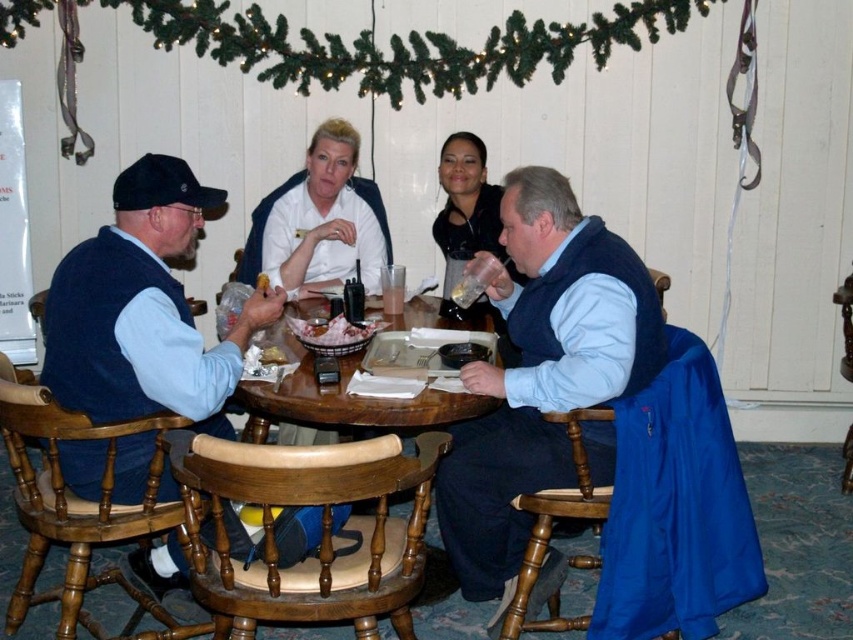
Question: Which of the following is the closest to the observer?

Choices:
 (A) matte brown basket at center
 (B) blue fleece vest at center

Answer: (B)

Question: Does blue denim vest at left appear under white smooth shirt at center?

Choices:
 (A) yes
 (B) no

Answer: (A)

Question: Does blue fleece vest at center have a larger size compared to translucent plastic cup at center?

Choices:
 (A) yes
 (B) no

Answer: (A)

Question: Which object is farther from the camera taking this photo?

Choices:
 (A) blue fleece vest at center
 (B) wooden table at center
 (C) matte black jacket at center
 (D) matte brown basket at center

Answer: (C)

Question: Which point is farther from the camera taking this photo?

Choices:
 (A) (50, 353)
 (B) (500, 468)
 (C) (264, 417)

Answer: (C)

Question: Considering the relative positions of white smooth shirt at center and translucent plastic cup at center in the image provided, where is white smooth shirt at center located with respect to translucent plastic cup at center?

Choices:
 (A) right
 (B) left

Answer: (B)